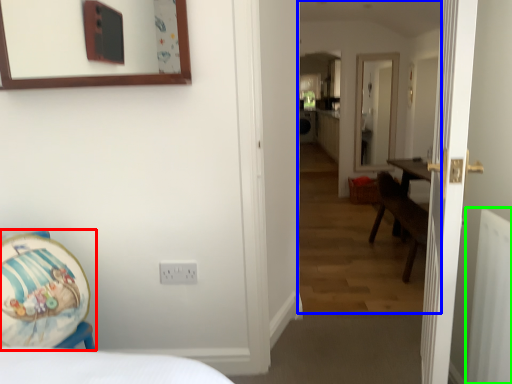
Question: Which object is the farthest from armchair (highlighted by a red box)? Choose among these: corridor (highlighted by a blue box) or radiator (highlighted by a green box).

Choices:
 (A) corridor
 (B) radiator

Answer: (A)